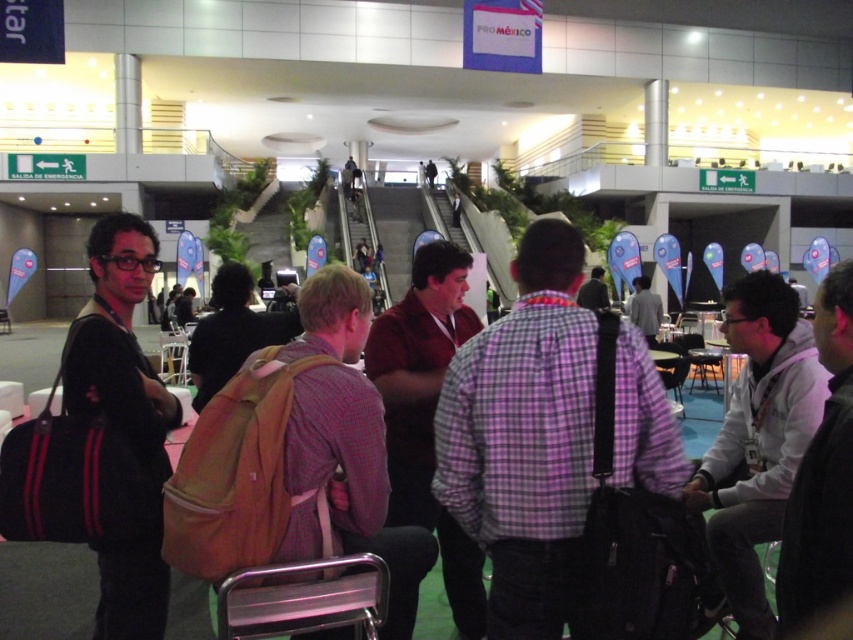
Question: Can you confirm if black fabric bag at left is smaller than light gray shirt at center?

Choices:
 (A) no
 (B) yes

Answer: (A)

Question: Can you confirm if light gray shirt at center is positioned above metallic silver chair at lower center?

Choices:
 (A) yes
 (B) no

Answer: (A)

Question: Can you confirm if light gray hoodie at lower right is smaller than dark gray shirt at center?

Choices:
 (A) no
 (B) yes

Answer: (A)

Question: Which point is closer to the camera?

Choices:
 (A) (480, 582)
 (B) (358, 509)
 (C) (602, 273)

Answer: (B)

Question: Which object is the farthest from the metallic silver chair at lower center?

Choices:
 (A) plaid shirt at center
 (B) black fabric bag at left
 (C) light gray hoodie at lower right

Answer: (A)

Question: Which point is closer to the camera?

Choices:
 (A) matte brown shirt at center
 (B) light gray hoodie at lower right
 (C) black fabric bag at left

Answer: (B)